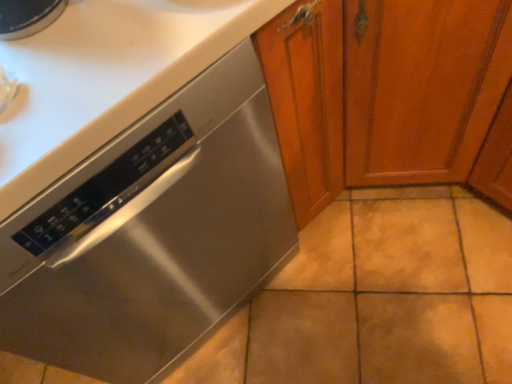
Where is `stainless steel dishwasher at lower left`? The width and height of the screenshot is (512, 384). stainless steel dishwasher at lower left is located at coordinates [152, 234].

What do you see at coordinates (152, 234) in the screenshot? The image size is (512, 384). I see `stainless steel dishwasher at lower left` at bounding box center [152, 234].

Locate an element on the screen. stained wood cabinet at center is located at coordinates (388, 95).

What is the approximate width of stained wood cabinet at center?

32.87 inches.

The image size is (512, 384). What do you see at coordinates (388, 95) in the screenshot?
I see `stained wood cabinet at center` at bounding box center [388, 95].

Find the location of a particular element. This screenshot has height=384, width=512. stainless steel dishwasher at lower left is located at coordinates (152, 234).

Is stained wood cabinet at center at the left side of stainless steel dishwasher at lower left?

In fact, stained wood cabinet at center is to the right of stainless steel dishwasher at lower left.

Is stained wood cabinet at center behind stainless steel dishwasher at lower left?

No, it is in front of stainless steel dishwasher at lower left.

Which is in front, point (308, 182) or point (172, 309)?

Positioned in front is point (172, 309).

Based on the photo, from the image's perspective, between stained wood cabinet at center and stainless steel dishwasher at lower left, which one is located above?

stained wood cabinet at center appears higher in the image.

From a real-world perspective, is stained wood cabinet at center positioned over stainless steel dishwasher at lower left based on gravity?

Indeed, from a real-world perspective, stained wood cabinet at center stands above stainless steel dishwasher at lower left.

Can you confirm if stained wood cabinet at center is wider than stainless steel dishwasher at lower left?

Yes.

Can you confirm if stained wood cabinet at center is shorter than stainless steel dishwasher at lower left?

In fact, stained wood cabinet at center may be taller than stainless steel dishwasher at lower left.

Which of these two, stained wood cabinet at center or stainless steel dishwasher at lower left, is smaller?

With smaller size is stainless steel dishwasher at lower left.

From the picture: Is stainless steel dishwasher at lower left inside stained wood cabinet at center?

No, stainless steel dishwasher at lower left is located outside of stained wood cabinet at center.

Is stained wood cabinet at center placed right next to stainless steel dishwasher at lower left?

No, stained wood cabinet at center is not touching stainless steel dishwasher at lower left.

Is stained wood cabinet at center aimed at stainless steel dishwasher at lower left?

No, stained wood cabinet at center is not turned towards stainless steel dishwasher at lower left.

How many degrees apart are the facing directions of stained wood cabinet at center and stainless steel dishwasher at lower left?

0.000114 degrees separate the facing orientations of stained wood cabinet at center and stainless steel dishwasher at lower left.

Locate an element on the screen. Image resolution: width=512 pixels, height=384 pixels. home appliance to the left of stained wood cabinet at center is located at coordinates (152, 234).

Would you say stainless steel dishwasher at lower left is to the left or to the right of stained wood cabinet at center in the picture?

stainless steel dishwasher at lower left is positioned on stained wood cabinet at center's left side.

Considering the relative positions of stainless steel dishwasher at lower left and stained wood cabinet at center in the image provided, is stainless steel dishwasher at lower left in front of stained wood cabinet at center?

No, the depth of stainless steel dishwasher at lower left is greater than that of stained wood cabinet at center.

Which is less distant, (x=84, y=195) or (x=404, y=62)?

Clearly, point (x=84, y=195) is closer to the camera than point (x=404, y=62).

From the image's perspective, which is below, stainless steel dishwasher at lower left or stained wood cabinet at center?

stainless steel dishwasher at lower left.

From a real-world perspective, is stainless steel dishwasher at lower left positioned above or below stained wood cabinet at center?

From a real-world perspective, stainless steel dishwasher at lower left is physically below stained wood cabinet at center.

Which object is wider, stainless steel dishwasher at lower left or stained wood cabinet at center?

stained wood cabinet at center is wider.

Considering the relative sizes of stainless steel dishwasher at lower left and stained wood cabinet at center in the image provided, is stainless steel dishwasher at lower left shorter than stained wood cabinet at center?

Yes.

Considering the relative sizes of stainless steel dishwasher at lower left and stained wood cabinet at center in the image provided, is stainless steel dishwasher at lower left smaller than stained wood cabinet at center?

Correct, stainless steel dishwasher at lower left occupies less space than stained wood cabinet at center.

Is stainless steel dishwasher at lower left inside the boundaries of stained wood cabinet at center, or outside?

stainless steel dishwasher at lower left is outside stained wood cabinet at center.

Can you see stainless steel dishwasher at lower left touching stained wood cabinet at center?

No, stainless steel dishwasher at lower left is not beside stained wood cabinet at center.

Is stainless steel dishwasher at lower left facing towards stained wood cabinet at center?

No, stainless steel dishwasher at lower left is not oriented towards stained wood cabinet at center.

Can you tell me how much stainless steel dishwasher at lower left and stained wood cabinet at center differ in facing direction?

The angle between the facing direction of stainless steel dishwasher at lower left and the facing direction of stained wood cabinet at center is 0.000114 degrees.

Find the location of a particular element. Image resolution: width=512 pixels, height=384 pixels. home appliance below the stained wood cabinet at center (from a real-world perspective) is located at coordinates (152, 234).

You are a GUI agent. You are given a task and a screenshot of the screen. Output one action in this format:
    pyautogui.click(x=<x>, y=<y>)
    Task: Click on the home appliance below the stained wood cabinet at center (from a real-world perspective)
    Image resolution: width=512 pixels, height=384 pixels.
    Given the screenshot: What is the action you would take?
    pyautogui.click(x=152, y=234)

Locate an element on the screen. cabinetry located above the stainless steel dishwasher at lower left (from the image's perspective) is located at coordinates (388, 95).